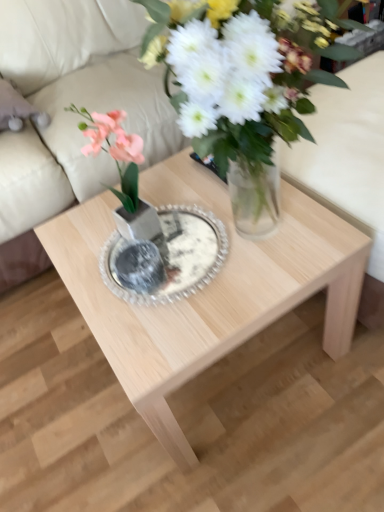
Where is `blank area to the left of natural wood coffee table at center`? This screenshot has width=384, height=512. blank area to the left of natural wood coffee table at center is located at coordinates (63, 395).